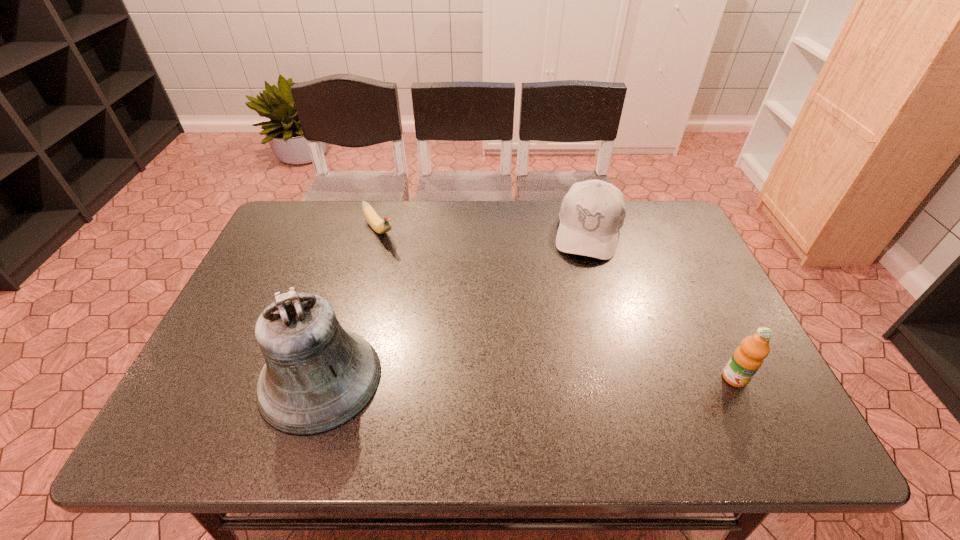
Where is `vacant region at the left edge of the desktop`? Image resolution: width=960 pixels, height=540 pixels. vacant region at the left edge of the desktop is located at coordinates (306, 278).

Find the location of a particular element. This screenshot has height=540, width=960. vacant region at the right edge is located at coordinates (660, 283).

You are a GUI agent. You are given a task and a screenshot of the screen. Output one action in this format:
    pyautogui.click(x=<x>, y=<y>)
    Task: Click on the free region at the far left corner of the desktop
    This screenshot has height=540, width=960.
    Given the screenshot: What is the action you would take?
    pyautogui.click(x=319, y=233)

Locate an element on the screen. vacant space at the far right corner is located at coordinates (637, 216).

The width and height of the screenshot is (960, 540). Find the location of `free region at the near right corner of the desktop`. free region at the near right corner of the desktop is located at coordinates (713, 376).

Find the location of a particular element. Image resolution: width=960 pixels, height=540 pixels. free space between the second object from right to left and the orange juice is located at coordinates (661, 305).

The width and height of the screenshot is (960, 540). In order to click on blank region between the orange juice and the banana in this screenshot , I will do `click(557, 304)`.

You are a GUI agent. You are given a task and a screenshot of the screen. Output one action in this format:
    pyautogui.click(x=<x>, y=<y>)
    Task: Click on the unoccupied position between the baseball cap and the shortest object
    
    Given the screenshot: What is the action you would take?
    pyautogui.click(x=484, y=231)

This screenshot has height=540, width=960. Find the location of `unoccupied position between the shortest object and the third object from left to right`. unoccupied position between the shortest object and the third object from left to right is located at coordinates (484, 231).

Locate an element on the screen. This screenshot has width=960, height=540. vacant space in between the orange juice and the tallest object is located at coordinates (527, 379).